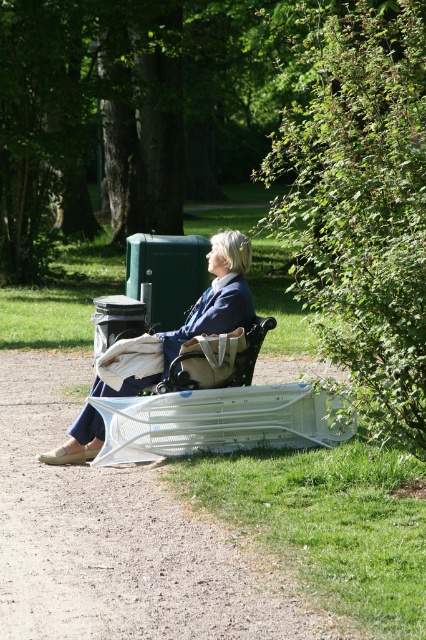
You are a gardener in the park and need to water the green leafy bush at right and the matte blue jacket at center. Which one should you water first according to their positions?

The green leafy bush at right is positioned over the matte blue jacket at center, so you should water the green leafy bush at right first to avoid getting the matte blue jacket at center wet.

You are standing in the park and want to take a photo of the green leafy bush at right and the matte blue jacket at center. Which object should you focus on first to ensure both are in the frame?

You should focus on the matte blue jacket at center first because it is farther from the viewer than the green leafy bush at right, ensuring both are in the frame.

You are planning to take a photo of the wooden textured chair at center and the green leafy bush at right. Which object should you focus on first if you want to capture both in a single frame without moving the camera?

The green leafy bush at right has a larger size compared to wooden textured chair at center, so you should focus on the green leafy bush at right first to ensure it fits properly in the frame.